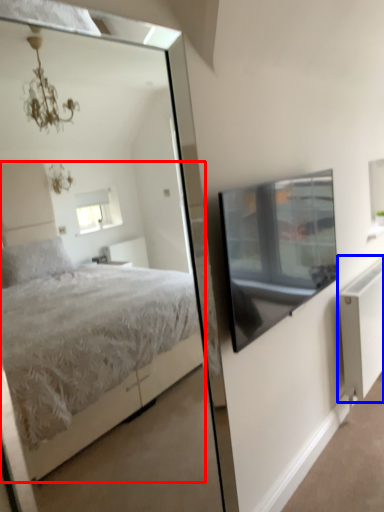
Question: Which point is closer to the camera, bed (highlighted by a red box) or radiator (highlighted by a blue box)?

Choices:
 (A) bed
 (B) radiator

Answer: (A)